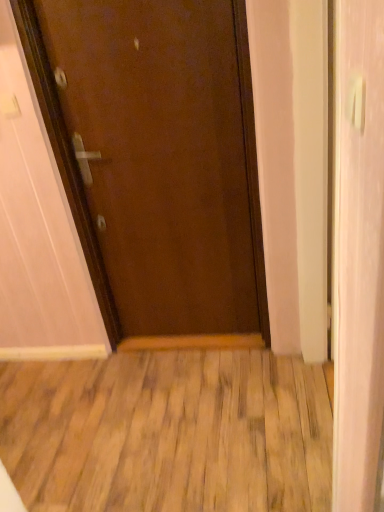
Identify the location of vacant space behind white glossy door at right. (272, 378).